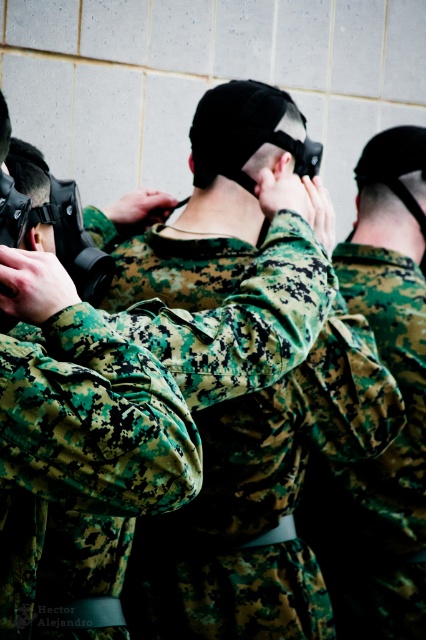
Question: Which of the following is the closest to the observer?

Choices:
 (A) camouflage fabric at center
 (B) camouflage fabric uniform at center

Answer: (B)

Question: Does camouflage fabric uniform at center appear over camouflage fabric at center?

Choices:
 (A) no
 (B) yes

Answer: (A)

Question: Which of the following is the closest to the observer?

Choices:
 (A) camouflage fabric uniform at center
 (B) camouflage fabric at center

Answer: (A)

Question: Which object is farther from the camera taking this photo?

Choices:
 (A) camouflage fabric uniform at center
 (B) camouflage fabric at center

Answer: (B)

Question: Is camouflage fabric uniform at center positioned at the back of camouflage fabric at center?

Choices:
 (A) no
 (B) yes

Answer: (A)

Question: Does camouflage fabric uniform at center have a greater width compared to camouflage fabric at center?

Choices:
 (A) no
 (B) yes

Answer: (B)